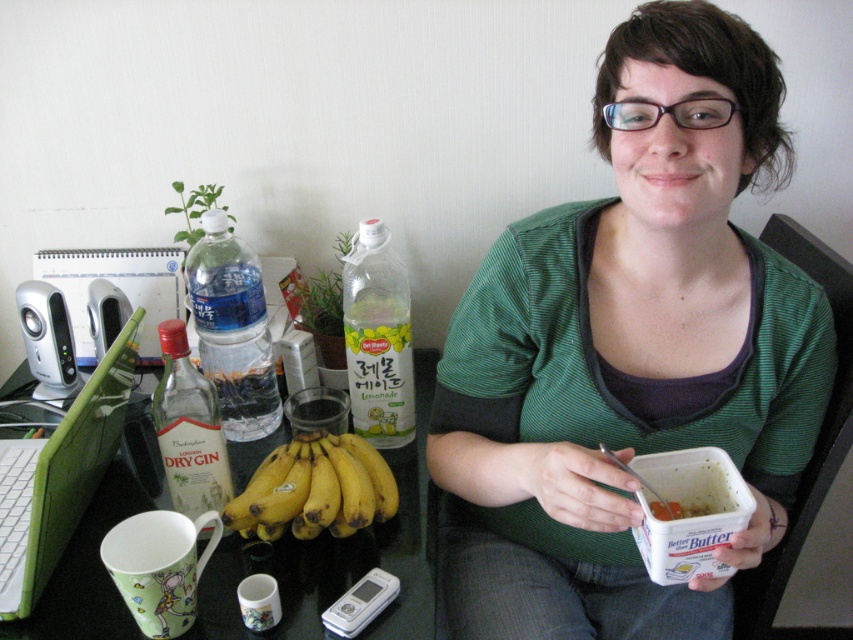
Question: Considering the real-world distances, which object is closest to the green striped shirt at center?

Choices:
 (A) green plastic table at lower left
 (B) green fabric chair at upper right

Answer: (B)

Question: Is translucent plastic bottle at center above green fabric chair at upper right?

Choices:
 (A) no
 (B) yes

Answer: (B)

Question: Among these objects, which one is farthest from the camera?

Choices:
 (A) green plastic table at lower left
 (B) green plastic laptop at lower left

Answer: (A)

Question: Considering the relative positions of green plastic table at lower left and translucent plastic bottle at center in the image provided, where is green plastic table at lower left located with respect to translucent plastic bottle at center?

Choices:
 (A) below
 (B) above

Answer: (A)

Question: Which point is closer to the camera taking this photo?

Choices:
 (A) (492, 593)
 (B) (412, 385)
 (C) (793, 241)
 (D) (115, 355)

Answer: (D)

Question: Can you confirm if clear plastic bottle at left is positioned below green fabric chair at upper right?

Choices:
 (A) no
 (B) yes

Answer: (A)